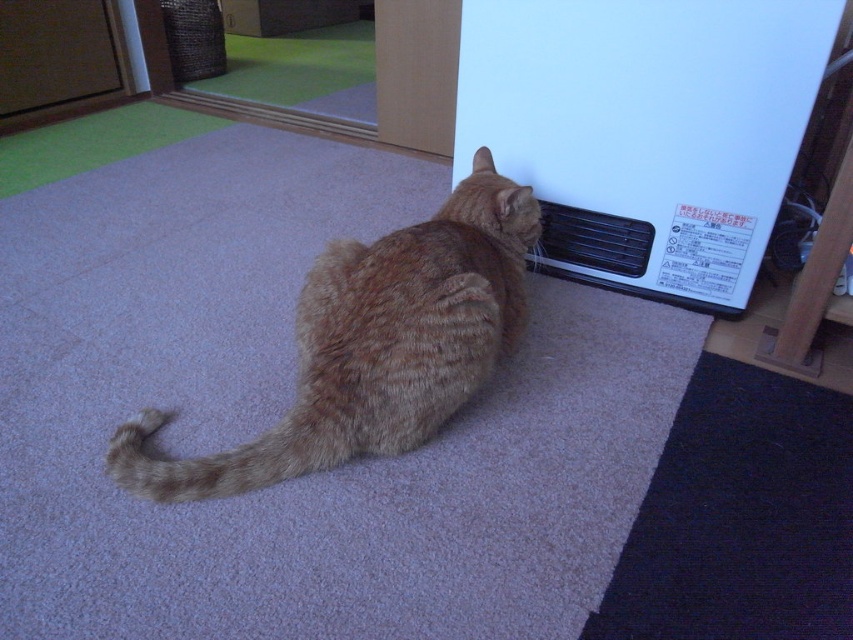
You are a delivery person who just arrived at this house. You need to place a new white plastic heater at the exact location where the ginger cat is currently sitting. The ginger cat is sitting at point [645,129]. However, there is already an object at that point. What object is currently occupying that spot?

The white plastic heater at lower right is currently occupying the point [645,129].

Consider the image. You are a pet sitter and need to move the orange tabby cat at center to a safe spot away from the white plastic heater at lower right. Which direction should you move the cat to ensure it is no longer near the heater?

The white plastic heater at lower right is positioned over orange tabby cat at center, so moving the cat to the left or upwards would place it away from the heater.

You are a delivery person who needs to place a small package on the floor next to the white plastic heater at lower right and the orange tabby cat at center. Considering their sizes, which object should you avoid placing the package too close to?

The white plastic heater at lower right is bigger than the orange tabby cat at center, so you should avoid placing the package too close to the white plastic heater at lower right to ensure there is enough space.